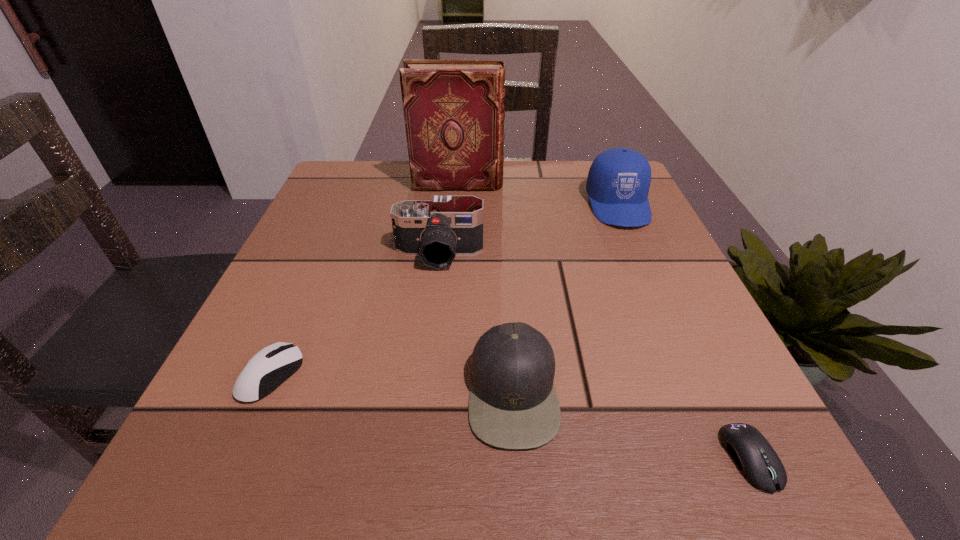
You are a GUI agent. You are given a task and a screenshot of the screen. Output one action in this format:
    pyautogui.click(x=<x>, y=<y>)
    Task: Click on the blank region between the hardback book and the farther cap
    The image size is (960, 540).
    Given the screenshot: What is the action you would take?
    pyautogui.click(x=539, y=194)

Locate an element on the screen. The height and width of the screenshot is (540, 960). vacant space that is in between the farther cap and the camera is located at coordinates (529, 230).

Locate which object ranks fifth in proximity to the shortest object. Please provide its 2D coordinates. Your answer should be formatted as a tuple, i.e. [(x, y)], where the tuple contains the x and y coordinates of a point satisfying the conditions above.

[(454, 114)]

Locate which object is the closest to the leftmost object. Please provide its 2D coordinates. Your answer should be formatted as a tuple, i.e. [(x, y)], where the tuple contains the x and y coordinates of a point satisfying the conditions above.

[(448, 226)]

Image resolution: width=960 pixels, height=540 pixels. Identify the location of vacant area in the image that satisfies the following two spatial constraints: 1. on the front-facing side of the nearer computer equipment; 2. on the left side of the fourth nearest object. (417, 458).

Find the location of a particular element. vacant region that satisfies the following two spatial constraints: 1. on the brim of the third shortest object; 2. on the back side of the right computer equipment is located at coordinates (517, 458).

This screenshot has height=540, width=960. What are the coordinates of `free space that satisfies the following two spatial constraints: 1. on the front-facing side of the right cap; 2. on the right side of the nearer computer equipment` in the screenshot? It's located at (730, 458).

You are a GUI agent. You are given a task and a screenshot of the screen. Output one action in this format:
    pyautogui.click(x=<x>, y=<y>)
    Task: Click on the free location that satisfies the following two spatial constraints: 1. on the front-facing side of the farther cap; 2. on the brim of the left cap
    This screenshot has width=960, height=540.
    Given the screenshot: What is the action you would take?
    pyautogui.click(x=701, y=392)